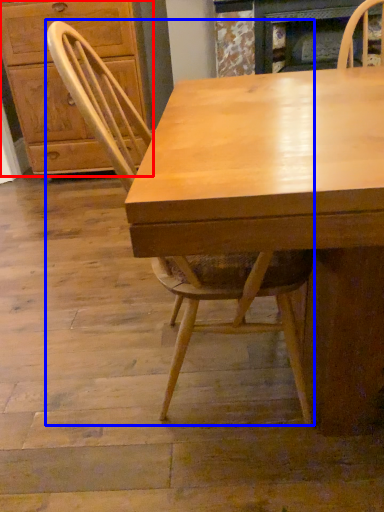
Question: Among these objects, which one is farthest to the camera, cabinetry (highlighted by a red box) or chair (highlighted by a blue box)?

Choices:
 (A) cabinetry
 (B) chair

Answer: (A)